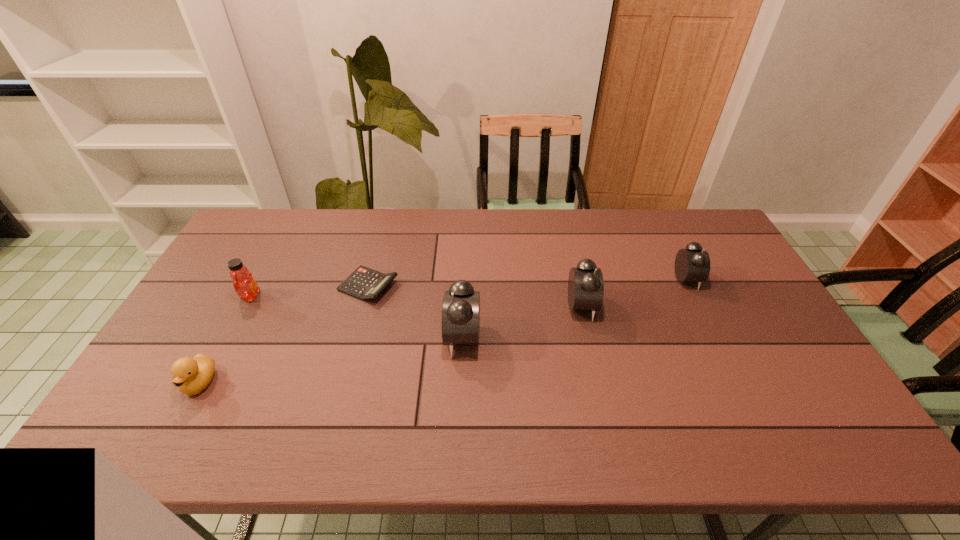
Where is `free point that keeps the alarm clocks evenly spaced on the left`? The image size is (960, 540). free point that keeps the alarm clocks evenly spaced on the left is located at coordinates (325, 372).